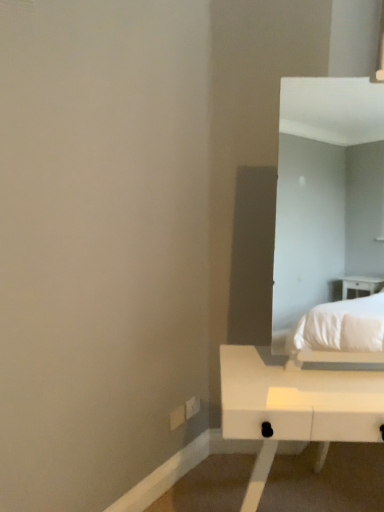
Find the location of a particular element. white plastic electric outlet at lower center, marked as the 2th electric outlet in a left-to-right arrangement is located at coordinates (192, 407).

What do you see at coordinates (177, 417) in the screenshot? This screenshot has width=384, height=512. I see `white plastic electric outlet at lower center, positioned as the 2th electric outlet in right-to-left order` at bounding box center [177, 417].

The height and width of the screenshot is (512, 384). Describe the element at coordinates (294, 408) in the screenshot. I see `white matte table at lower right` at that location.

Identify the location of white plastic electric outlet at lower center, marked as the 2th electric outlet in a left-to-right arrangement. (192, 407).

Can you tell me how much white plastic electric outlet at lower center, positioned as the 2th electric outlet in right-to-left order, and white plastic electric outlet at lower center, which is the 1th electric outlet from right to left, differ in facing direction?

white plastic electric outlet at lower center, positioned as the 2th electric outlet in right-to-left order, and white plastic electric outlet at lower center, which is the 1th electric outlet from right to left, are facing 1.63 degrees away from each other.

Considering the points (175, 413) and (193, 415), which point is behind, point (175, 413) or point (193, 415)?

The point (193, 415) is more distant.

Based on their positions, is white plastic electric outlet at lower center, positioned as the 2th electric outlet in right-to-left order, located to the left or right of white plastic electric outlet at lower center, marked as the 2th electric outlet in a left-to-right arrangement?

white plastic electric outlet at lower center, positioned as the 2th electric outlet in right-to-left order, is to the left of white plastic electric outlet at lower center, marked as the 2th electric outlet in a left-to-right arrangement.

Is white plastic electric outlet at lower center, positioned as the 2th electric outlet in right-to-left order, next to white plastic electric outlet at lower center, which is the 1th electric outlet from right to left, and touching it?

Yes, white plastic electric outlet at lower center, positioned as the 2th electric outlet in right-to-left order, is right next to white plastic electric outlet at lower center, which is the 1th electric outlet from right to left, and making contact.

How many degrees apart are the facing directions of white plastic electric outlet at lower center, marked as the 2th electric outlet in a left-to-right arrangement, and white matte table at lower right?

The angular difference between white plastic electric outlet at lower center, marked as the 2th electric outlet in a left-to-right arrangement, and white matte table at lower right is 54.5 degrees.

Does white plastic electric outlet at lower center, marked as the 2th electric outlet in a left-to-right arrangement, come in front of white matte table at lower right?

No.

How distant is white plastic electric outlet at lower center, which is the 1th electric outlet from right to left, from white matte table at lower right?

They are 27.16 inches apart.

Find the location of `table below the white plastic electric outlet at lower center, which is the 1th electric outlet from right to left (from the image's perspective)`. table below the white plastic electric outlet at lower center, which is the 1th electric outlet from right to left (from the image's perspective) is located at coordinates (294, 408).

Considering the sizes of objects white matte table at lower right and white plastic electric outlet at lower center, positioned as the 2th electric outlet in right-to-left order, in the image provided, who is thinner, white matte table at lower right or white plastic electric outlet at lower center, positioned as the 2th electric outlet in right-to-left order,?

Thinner between the two is white plastic electric outlet at lower center, positioned as the 2th electric outlet in right-to-left order.

Which is less distant, (284,377) or (171,428)?

The point (284,377) is closer.

Do you think white matte table at lower right is within white plastic electric outlet at lower center, the 1th electric outlet from the left, or outside of it?

white matte table at lower right exists outside the volume of white plastic electric outlet at lower center, the 1th electric outlet from the left.

From the picture: Is white matte table at lower right in front of white plastic electric outlet at lower center, the 1th electric outlet from the left?

Yes.

I want to click on table above the white plastic electric outlet at lower center, which is the 1th electric outlet from right to left (from a real-world perspective), so click(294, 408).

Is white matte table at lower right behind white plastic electric outlet at lower center, marked as the 2th electric outlet in a left-to-right arrangement?

No, white matte table at lower right is closer to the viewer.

From a real-world perspective, is white matte table at lower right positioned above or below white plastic electric outlet at lower center, marked as the 2th electric outlet in a left-to-right arrangement?

white matte table at lower right is above white plastic electric outlet at lower center, marked as the 2th electric outlet in a left-to-right arrangement.

Is white matte table at lower right situated inside white plastic electric outlet at lower center, marked as the 2th electric outlet in a left-to-right arrangement, or outside?

white matte table at lower right is located beyond the bounds of white plastic electric outlet at lower center, marked as the 2th electric outlet in a left-to-right arrangement.

Is white plastic electric outlet at lower center, the 1th electric outlet from the left, inside the boundaries of white matte table at lower right, or outside?

white plastic electric outlet at lower center, the 1th electric outlet from the left, is outside white matte table at lower right.

Is white plastic electric outlet at lower center, positioned as the 2th electric outlet in right-to-left order, shorter than white matte table at lower right?

Yes.

Considering the relative sizes of white plastic electric outlet at lower center, the 1th electric outlet from the left, and white matte table at lower right in the image provided, is white plastic electric outlet at lower center, the 1th electric outlet from the left, thinner than white matte table at lower right?

Yes.

From the image's perspective, is white plastic electric outlet at lower center, positioned as the 2th electric outlet in right-to-left order, below white matte table at lower right?

No.

Is white plastic electric outlet at lower center, marked as the 2th electric outlet in a left-to-right arrangement, smaller than white plastic electric outlet at lower center, the 1th electric outlet from the left?

Actually, white plastic electric outlet at lower center, marked as the 2th electric outlet in a left-to-right arrangement, might be larger than white plastic electric outlet at lower center, the 1th electric outlet from the left.

Which object is thinner, white plastic electric outlet at lower center, which is the 1th electric outlet from right to left, or white plastic electric outlet at lower center, positioned as the 2th electric outlet in right-to-left order?

white plastic electric outlet at lower center, positioned as the 2th electric outlet in right-to-left order.

Does point (185, 418) lie behind point (180, 405)?

That is True.

Would you say white plastic electric outlet at lower center, which is the 1th electric outlet from right to left, is a long distance from white plastic electric outlet at lower center, the 1th electric outlet from the left?

No.

You are a GUI agent. You are given a task and a screenshot of the screen. Output one action in this format:
    pyautogui.click(x=<x>, y=<y>)
    Task: Click on the electric outlet that appears behind the white plastic electric outlet at lower center, positioned as the 2th electric outlet in right-to-left order
    The image size is (384, 512).
    Given the screenshot: What is the action you would take?
    pyautogui.click(x=192, y=407)

The image size is (384, 512). In order to click on the 2nd electric outlet located beneath the white matte table at lower right (from a real-world perspective) in this screenshot , I will do click(192, 407).

Estimate the real-world distances between objects in this image. Which object is further from white plastic electric outlet at lower center, positioned as the 2th electric outlet in right-to-left order, white matte table at lower right or white plastic electric outlet at lower center, which is the 1th electric outlet from right to left?

white matte table at lower right lies further to white plastic electric outlet at lower center, positioned as the 2th electric outlet in right-to-left order, than the other object.

Looking at the image, which one is located further to white plastic electric outlet at lower center, the 1th electric outlet from the left, white plastic electric outlet at lower center, marked as the 2th electric outlet in a left-to-right arrangement, or white matte table at lower right?

The object further to white plastic electric outlet at lower center, the 1th electric outlet from the left, is white matte table at lower right.

Looking at the image, which one is located closer to white matte table at lower right, white plastic electric outlet at lower center, positioned as the 2th electric outlet in right-to-left order, or white plastic electric outlet at lower center, marked as the 2th electric outlet in a left-to-right arrangement?

Based on the image, white plastic electric outlet at lower center, positioned as the 2th electric outlet in right-to-left order, appears to be nearer to white matte table at lower right.

Which object lies nearer to the anchor point white matte table at lower right, white plastic electric outlet at lower center, which is the 1th electric outlet from right to left, or white plastic electric outlet at lower center, the 1th electric outlet from the left?

white plastic electric outlet at lower center, the 1th electric outlet from the left, is closer to white matte table at lower right.

Which object lies nearer to the anchor point white plastic electric outlet at lower center, marked as the 2th electric outlet in a left-to-right arrangement, white plastic electric outlet at lower center, positioned as the 2th electric outlet in right-to-left order, or white matte table at lower right?

white plastic electric outlet at lower center, positioned as the 2th electric outlet in right-to-left order, is closer to white plastic electric outlet at lower center, marked as the 2th electric outlet in a left-to-right arrangement.

Based on their spatial positions, is white matte table at lower right or white plastic electric outlet at lower center, the 1th electric outlet from the left, closer to white plastic electric outlet at lower center, marked as the 2th electric outlet in a left-to-right arrangement?

white plastic electric outlet at lower center, the 1th electric outlet from the left, is positioned closer to the anchor white plastic electric outlet at lower center, marked as the 2th electric outlet in a left-to-right arrangement.

In order to click on electric outlet located between white matte table at lower right and white plastic electric outlet at lower center, marked as the 2th electric outlet in a left-to-right arrangement, in the depth direction in this screenshot , I will do `click(177, 417)`.